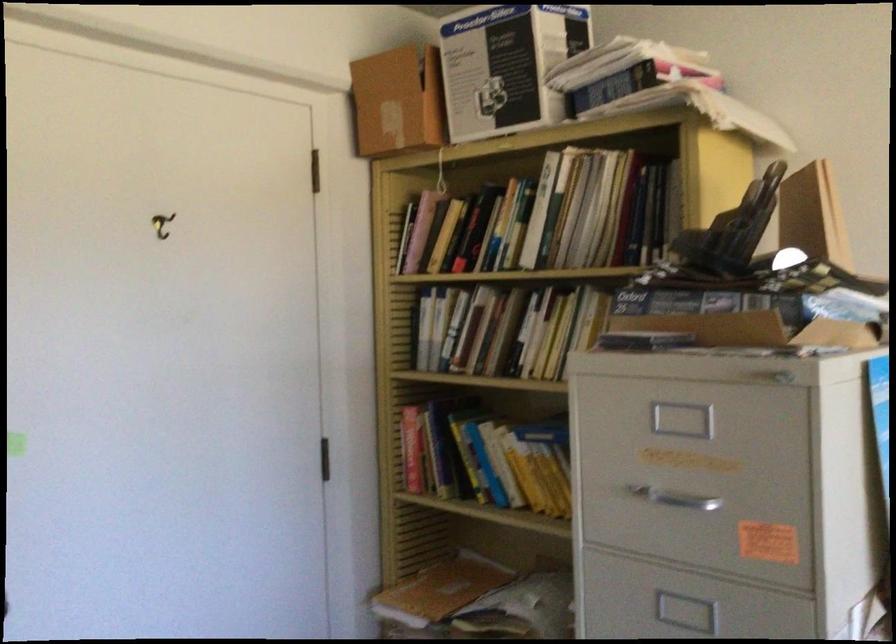
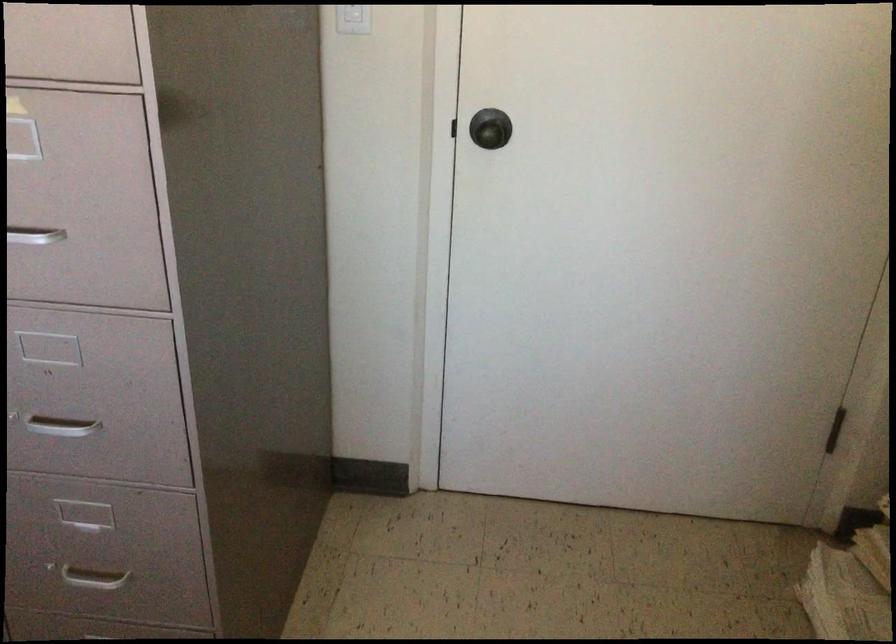
First-person continuous shooting, in which direction is the camera rotating?

The camera's rotation is toward left-down.